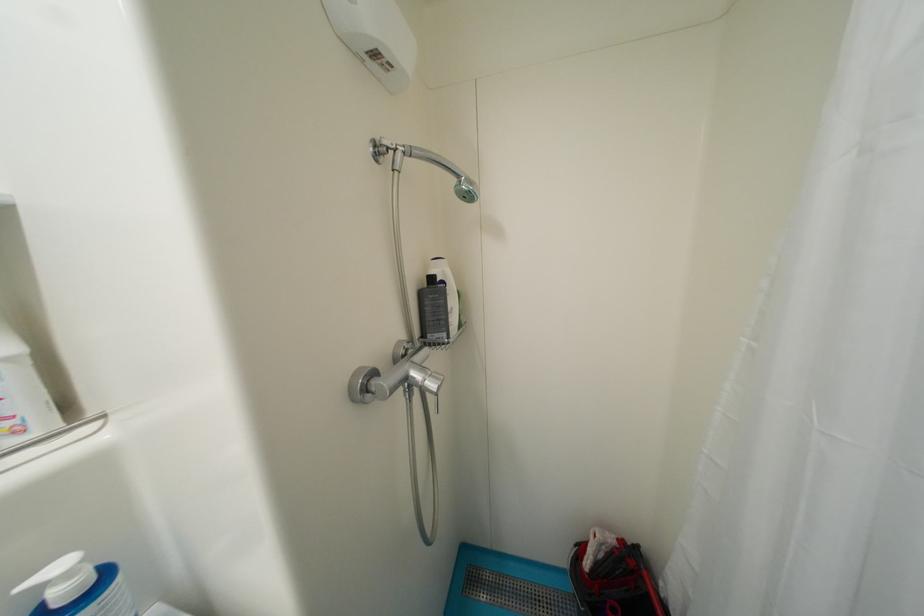
This screenshot has height=616, width=924. In order to click on black shampoo bottle in this screenshot , I will do `click(433, 312)`.